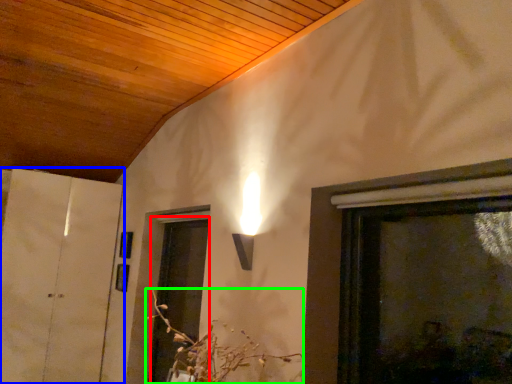
Question: Considering the real-world distances, which object is closest to screen door (highlighted by a red box)? door (highlighted by a blue box) or flower (highlighted by a green box).

Choices:
 (A) door
 (B) flower

Answer: (A)